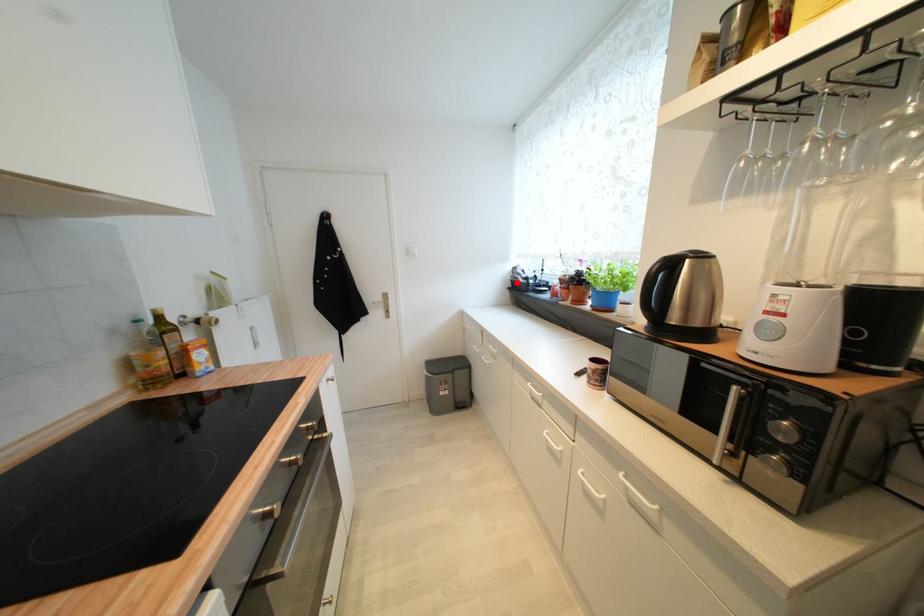
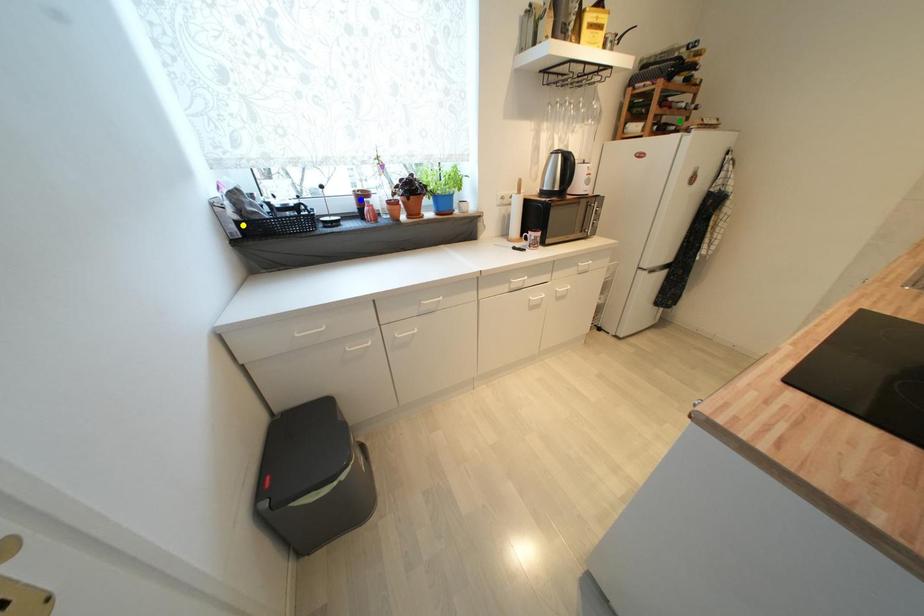
Question: I am providing you with two images of the same scene from different viewpoints. A red point is marked on the first image. You are given multiple points on the second image. Can you choose the point in image 2 that corresponds to the point in image 1?

Choices:
 (A) yellow point
 (B) green point
 (C) blue point

Answer: (A)